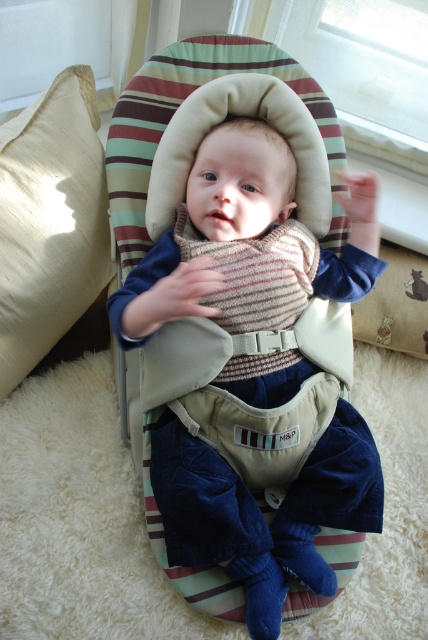
Question: Which point is farther to the camera?

Choices:
 (A) beige fabric pillow at left
 (B) striped knit sweater at center

Answer: (A)

Question: Does striped knit sweater at center appear on the left side of beige fabric pillow at left?

Choices:
 (A) yes
 (B) no

Answer: (B)

Question: Does striped knit sweater at center have a smaller size compared to beige fabric pillow at left?

Choices:
 (A) yes
 (B) no

Answer: (B)

Question: Is striped knit sweater at center thinner than beige fabric pillow at left?

Choices:
 (A) yes
 (B) no

Answer: (B)